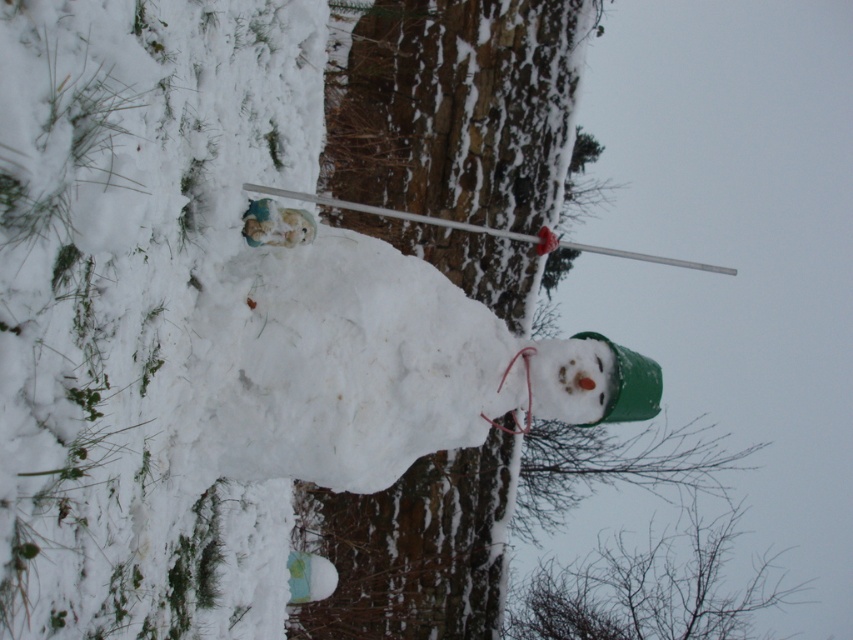
You are a delivery robot trying to reach the green matte snowman at center. The coordinates of your current position are at point 0.340, 0.538. In which direction should you move to reach the snowman?

The green matte snowman at center is located at point (457, 108). Your current position is at (457, 217). Since the x coordinate of the snowman is lower than yours, you should move to the left to reach it.

You are a winter explorer who has just arrived at the snowy scene. You need to determine which object is smaller between the silvery branches at lower right and the white plastic ski pole at upper center. Can you identify the smaller one?

The silvery branches at lower right has a smaller size compared to the white plastic ski pole at upper center, so the silvery branches at lower right is the smaller one.